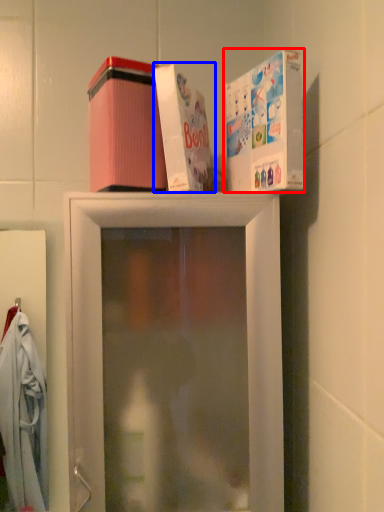
Question: Which point is further to the camera, box (highlighted by a red box) or box (highlighted by a blue box)?

Choices:
 (A) box
 (B) box

Answer: (B)